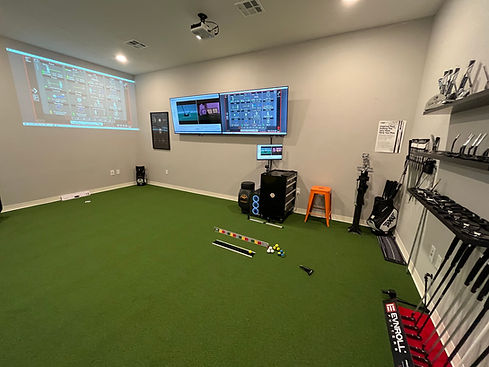
Find the location of a particular element. tv is located at coordinates (256, 109).